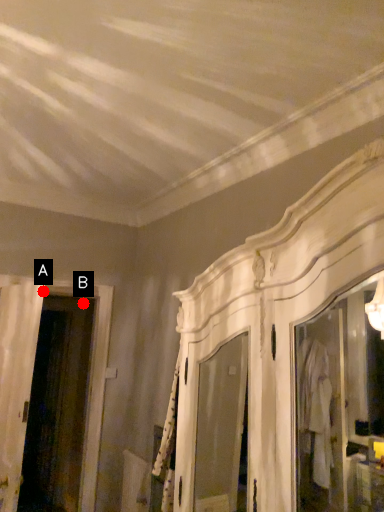
Question: Two points are circled on the image, labeled by A and B beside each circle. Which of the following is the farthest from the observer?

Choices:
 (A) A is further
 (B) B is further

Answer: (B)